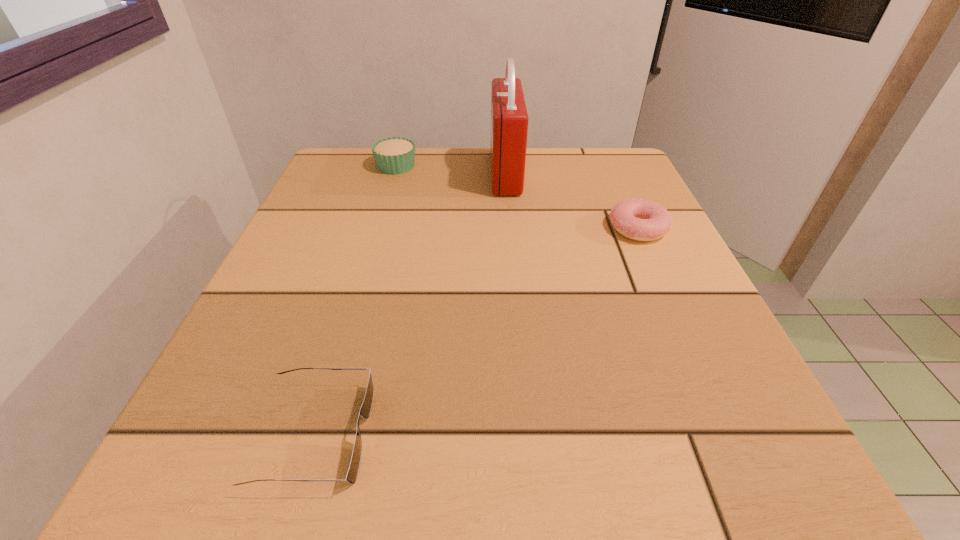
Identify the location of vacant space that is in between the nearest object and the rightmost object. The image size is (960, 540). (476, 331).

Find the location of `free space between the sunglasses and the third shortest object`. free space between the sunglasses and the third shortest object is located at coordinates (355, 300).

The width and height of the screenshot is (960, 540). I want to click on free spot between the cupcake and the sunglasses, so click(355, 300).

The image size is (960, 540). Identify the location of free point between the second nearest object and the third shortest object. (517, 197).

Find the location of `free spot between the tallest object and the sunglasses`. free spot between the tallest object and the sunglasses is located at coordinates pyautogui.click(x=410, y=303).

The height and width of the screenshot is (540, 960). Find the location of `vacant area that lies between the second object from right to left and the third shortest object`. vacant area that lies between the second object from right to left and the third shortest object is located at coordinates (451, 170).

Identify which object is located as the nearest to the second tallest object. Please provide its 2D coordinates. Your answer should be formatted as a tuple, i.e. [(x, y)], where the tuple contains the x and y coordinates of a point satisfying the conditions above.

[(509, 119)]

Select which object appears as the closest to the second object from right to left. Please provide its 2D coordinates. Your answer should be formatted as a tuple, i.e. [(x, y)], where the tuple contains the x and y coordinates of a point satisfying the conditions above.

[(639, 219)]

At what (x,y) coordinates should I click in order to perform the action: click on vacant area that satisfies the following two spatial constraints: 1. on the front face of the doughnut; 2. on the right side of the second object from right to left. Please return your answer as a coordinate pair (x, y). The image size is (960, 540). Looking at the image, I should click on (511, 228).

This screenshot has width=960, height=540. Find the location of `free location that satisfies the following two spatial constraints: 1. on the front face of the first-aid kit; 2. on the back side of the third farthest object`. free location that satisfies the following two spatial constraints: 1. on the front face of the first-aid kit; 2. on the back side of the third farthest object is located at coordinates (511, 228).